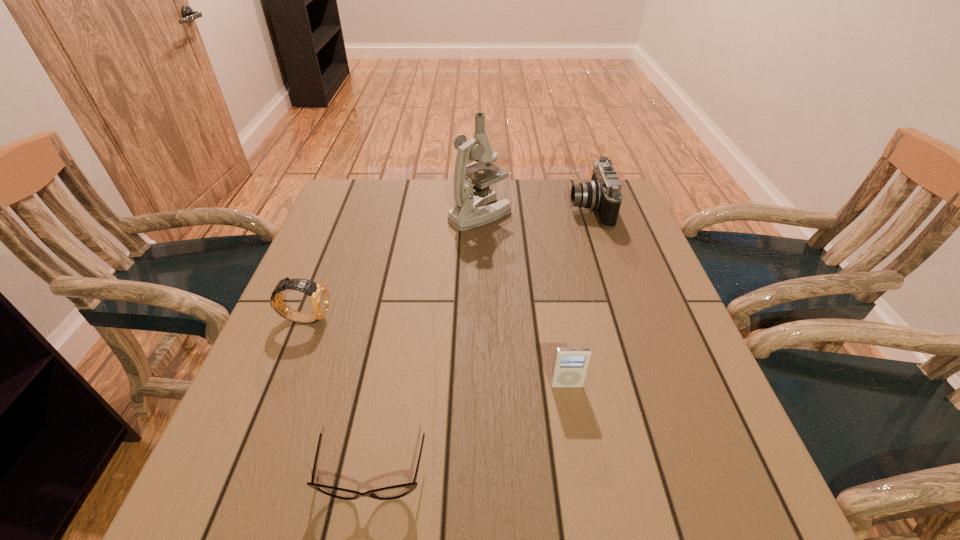
At what (x,y) coordinates should I click in order to perform the action: click on object positioned at the far right corner. Please return your answer as a coordinate pair (x, y). Looking at the image, I should click on (602, 195).

Where is `vacant area at the far edge of the desktop`? The width and height of the screenshot is (960, 540). vacant area at the far edge of the desktop is located at coordinates (564, 195).

This screenshot has height=540, width=960. Identify the location of vacant space at the near edge of the desktop. (492, 487).

Where is `blank area at the left edge`? blank area at the left edge is located at coordinates (297, 390).

In order to click on vacant region at the right edge of the desktop in this screenshot , I will do 600,287.

The width and height of the screenshot is (960, 540). I want to click on blank space at the far left corner, so click(342, 198).

In the image, there is a desktop. Where is `free region at the near left corner`? Image resolution: width=960 pixels, height=540 pixels. free region at the near left corner is located at coordinates (256, 481).

Image resolution: width=960 pixels, height=540 pixels. Find the location of `vacant space at the far right corner of the desktop`. vacant space at the far right corner of the desktop is located at coordinates (x=624, y=213).

Find the location of a particular element. Image resolution: width=960 pixels, height=540 pixels. empty location between the leftmost object and the second nearest object is located at coordinates (436, 352).

You are a GUI agent. You are given a task and a screenshot of the screen. Output one action in this format:
    pyautogui.click(x=<x>, y=<y>)
    Task: Click on the vacant point located between the spectacles and the leftmost object
    The height and width of the screenshot is (540, 960).
    Given the screenshot: What is the action you would take?
    pyautogui.click(x=339, y=397)